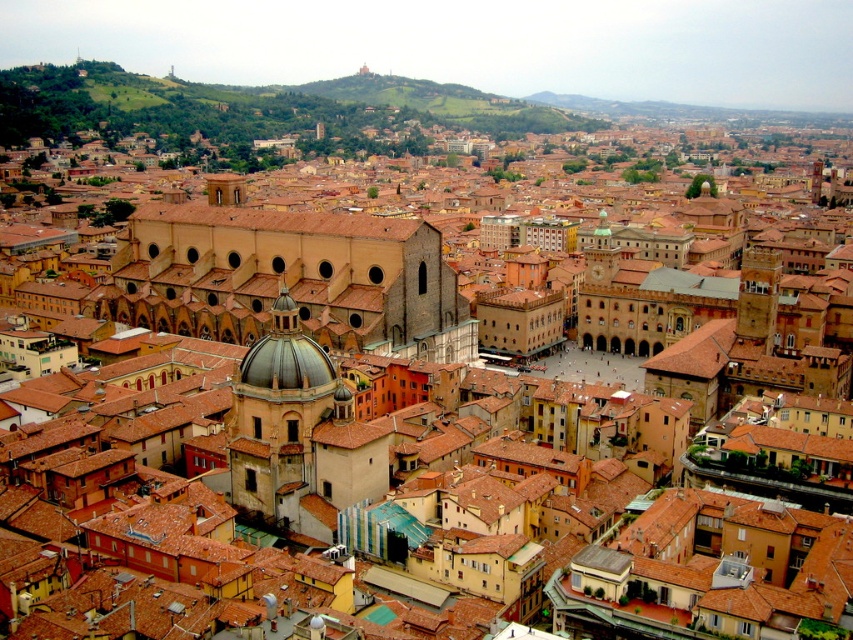
You are a drone operator who needs to fly a drone between the metallic dome at center and the brown tile roof at center. The drone has a maximum flight distance of 70 meters. Can the drone safely fly between them without exceeding its limit?

The metallic dome at center and brown tile roof at center are 69.56 meters apart from each other. Since the distance is under the drone maximum flight distance of 70 meters, the drone can safely fly between them without exceeding its limit.

You are an architect analyzing the cityscape. You need to determine which object has a wider base between the metallic dome at center and the brown tile roof at center. Which one is wider?

The metallic dome at center has a width less than the brown tile roof at center, so the brown tile roof at center has a wider base.